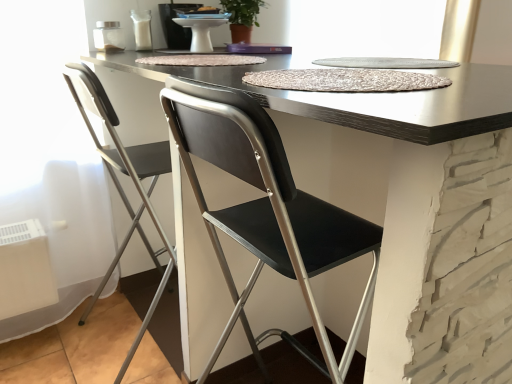
Where is `metallic silver folding chair at left`? This screenshot has height=384, width=512. metallic silver folding chair at left is located at coordinates (121, 186).

Find the location of a particular element. white glossy sink at upper center is located at coordinates (179, 24).

Locate an element on the screen. The width and height of the screenshot is (512, 384). metallic silver folding chair at left is located at coordinates (121, 186).

From a real-world perspective, who is located lower, white glossy sink at upper center or matte black table at center?

matte black table at center.

From the image's perspective, relative to matte black table at center, is white glossy sink at upper center above or below?

Based on their image positions, white glossy sink at upper center is located above matte black table at center.

Considering the points (174, 36) and (486, 236), which point is behind, point (174, 36) or point (486, 236)?

The point (174, 36) is farther.

Does white glossy sink at upper center appear on the left side of matte black table at center?

Yes, white glossy sink at upper center is to the left of matte black table at center.

Is metallic silver folding chair at left at the right side of white glossy sink at upper center?

No.

From the picture: Can you confirm if metallic silver folding chair at left is shorter than white glossy sink at upper center?

No, metallic silver folding chair at left is not shorter than white glossy sink at upper center.

This screenshot has height=384, width=512. Identify the location of sink on the right of the metallic silver folding chair at left. (179, 24).

Would you say metallic silver folding chair at left contains white glossy sink at upper center?

No, white glossy sink at upper center is not surrounded by metallic silver folding chair at left.

Is matte black table at center oriented towards metallic silver folding chair at left?

No.

Between matte black table at center and metallic silver folding chair at left, which one has smaller width?

Thinner between the two is metallic silver folding chair at left.

Is metallic silver folding chair at left completely or partially inside matte black table at center?

Yes, metallic silver folding chair at left is inside matte black table at center.

From a real-world perspective, which is physically above, matte black table at center or metallic silver folding chair at left?

metallic silver folding chair at left, from a real-world perspective.

Considering the sizes of objects metallic silver folding chair at left and matte black table at center in the image provided, who is bigger, metallic silver folding chair at left or matte black table at center?

matte black table at center is bigger.

Does point (86, 318) appear closer or farther from the camera than point (509, 299)?

Point (86, 318) appears to be farther away from the viewer than point (509, 299).

Considering the sizes of metallic silver folding chair at left and matte black table at center in the image, is metallic silver folding chair at left wider or thinner than matte black table at center?

Clearly, metallic silver folding chair at left has less width compared to matte black table at center.

Which is correct: metallic silver folding chair at left is inside matte black table at center, or outside of it?

metallic silver folding chair at left is inside matte black table at center.

Can you confirm if matte black table at center is smaller than white glossy sink at upper center?

Incorrect, matte black table at center is not smaller in size than white glossy sink at upper center.

In order to click on sink above the matte black table at center (from the image's perspective) in this screenshot , I will do `click(179, 24)`.

From a real-world perspective, is matte black table at center positioned under white glossy sink at upper center based on gravity?

Correct, in the physical world, matte black table at center is lower than white glossy sink at upper center.

Who is shorter, white glossy sink at upper center or metallic silver folding chair at left?

white glossy sink at upper center.

Looking at this image, from the image's perspective, relative to metallic silver folding chair at left, is white glossy sink at upper center above or below?

white glossy sink at upper center is situated higher than metallic silver folding chair at left in the image.

In terms of size, does white glossy sink at upper center appear bigger or smaller than metallic silver folding chair at left?

Clearly, white glossy sink at upper center is smaller in size than metallic silver folding chair at left.

I want to click on table located below the white glossy sink at upper center (from the image's perspective), so click(415, 210).

At what (x,y) coordinates should I click in order to perform the action: click on chair to the left of white glossy sink at upper center. Please return your answer as a coordinate pair (x, y). This screenshot has height=384, width=512. Looking at the image, I should click on (121, 186).

Which object lies nearer to the anchor point matte black table at center, white glossy sink at upper center or metallic silver folding chair at left?

metallic silver folding chair at left.

Looking at the image, which one is located further to metallic silver folding chair at left, matte black table at center or white glossy sink at upper center?

Based on the image, matte black table at center appears to be further to metallic silver folding chair at left.

From the image, which object appears to be nearer to white glossy sink at upper center, matte black table at center or metallic silver folding chair at left?

metallic silver folding chair at left is closer to white glossy sink at upper center.

When comparing their distances from metallic silver folding chair at left, does white glossy sink at upper center or matte black table at center seem closer?

white glossy sink at upper center lies closer to metallic silver folding chair at left than the other object.

Based on their spatial positions, is metallic silver folding chair at left or matte black table at center further from white glossy sink at upper center?

Based on the image, matte black table at center appears to be further to white glossy sink at upper center.

Estimate the real-world distances between objects in this image. Which object is further from matte black table at center, metallic silver folding chair at left or white glossy sink at upper center?

The object further to matte black table at center is white glossy sink at upper center.

Image resolution: width=512 pixels, height=384 pixels. I want to click on chair between matte black table at center and white glossy sink at upper center from front to back, so click(121, 186).